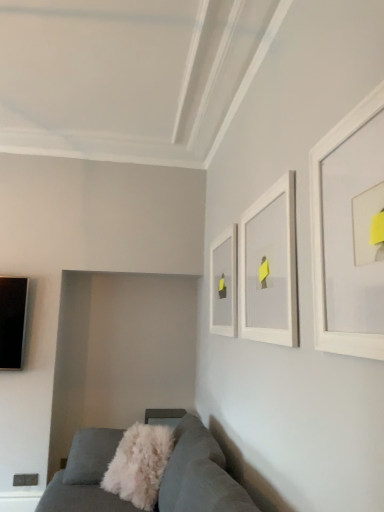
Question: Is white matte picture frame at upper center, the first picture frame positioned from the left, facing towards white matte picture frame at upper center, positioned as the second picture frame in left-to-right order?

Choices:
 (A) no
 (B) yes

Answer: (A)

Question: Is the position of white matte picture frame at upper center, placed as the third picture frame when sorted from front to back, less distant than that of white matte picture frame at upper center, positioned as the second picture frame in back-to-front order?

Choices:
 (A) yes
 (B) no

Answer: (B)

Question: Does white matte picture frame at upper center, the first picture frame positioned from the left, have a larger size compared to white matte picture frame at upper center, positioned as the second picture frame in back-to-front order?

Choices:
 (A) no
 (B) yes

Answer: (A)

Question: Is white matte picture frame at upper center, which is the 1th picture frame from back to front, further to the viewer compared to white matte picture frame at upper center, positioned as the second picture frame in back-to-front order?

Choices:
 (A) no
 (B) yes

Answer: (B)

Question: Considering the relative sizes of white matte picture frame at upper center, which is the 1th picture frame from back to front, and white matte picture frame at upper center, which ranks as the second picture frame in front-to-back order, in the image provided, is white matte picture frame at upper center, which is the 1th picture frame from back to front, thinner than white matte picture frame at upper center, which ranks as the second picture frame in front-to-back order,?

Choices:
 (A) yes
 (B) no

Answer: (A)

Question: Is white matte picture frame at upper center, which is the 1th picture frame from back to front, beside white matte picture frame at upper center, positioned as the second picture frame in back-to-front order?

Choices:
 (A) yes
 (B) no

Answer: (B)

Question: Is white matte picture frame at upper center, the first picture frame positioned from the left, a part of white matte picture frame at upper right, which is the first picture frame from right to left?

Choices:
 (A) no
 (B) yes

Answer: (A)

Question: Is white matte picture frame at upper right, acting as the first picture frame starting from the front, far from white matte picture frame at upper center, which is the 1th picture frame from back to front?

Choices:
 (A) no
 (B) yes

Answer: (B)

Question: Does white matte picture frame at upper right, acting as the first picture frame starting from the front, have a greater width compared to white matte picture frame at upper center, which is counted as the 3th picture frame, starting from the right?

Choices:
 (A) yes
 (B) no

Answer: (B)

Question: Is white matte picture frame at upper right, acting as the first picture frame starting from the front, closer to camera compared to white matte picture frame at upper center, which is counted as the 3th picture frame, starting from the right?

Choices:
 (A) no
 (B) yes

Answer: (B)

Question: From a real-world perspective, does white matte picture frame at upper right, which is the first picture frame from right to left, stand above white matte picture frame at upper center, placed as the third picture frame when sorted from front to back?

Choices:
 (A) yes
 (B) no

Answer: (A)

Question: From a real-world perspective, is white matte picture frame at upper right, which is the first picture frame from right to left, under white matte picture frame at upper center, the first picture frame positioned from the left?

Choices:
 (A) yes
 (B) no

Answer: (B)

Question: Can you confirm if velvet grey couch at lower left is positioned to the right of white matte picture frame at upper center, the first picture frame positioned from the left?

Choices:
 (A) yes
 (B) no

Answer: (B)